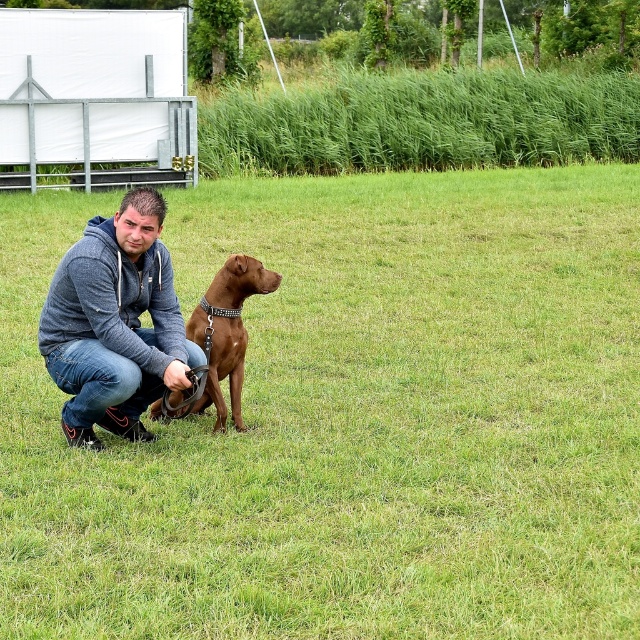
You are standing at the origin point of the coordinate system in the image. You want to walk towards the brown leather dog at center. Which direction should you move in the x and y axes?

The brown leather dog at center is located at coordinate point 0.656 on the x axis and 0.548 on the y axis, so you should move in the positive x and positive y direction to reach it.

You are standing in the field and want to reach the point marked at coordinates [237,552]. The temporary building behind the man is in your way. Can you walk around it to reach the point without going through the building?

The point marked at coordinates [237,552] is 17.20 feet away from the viewer. Since the temporary building is between you and the point, you can walk around it to reach the point without going through the building.